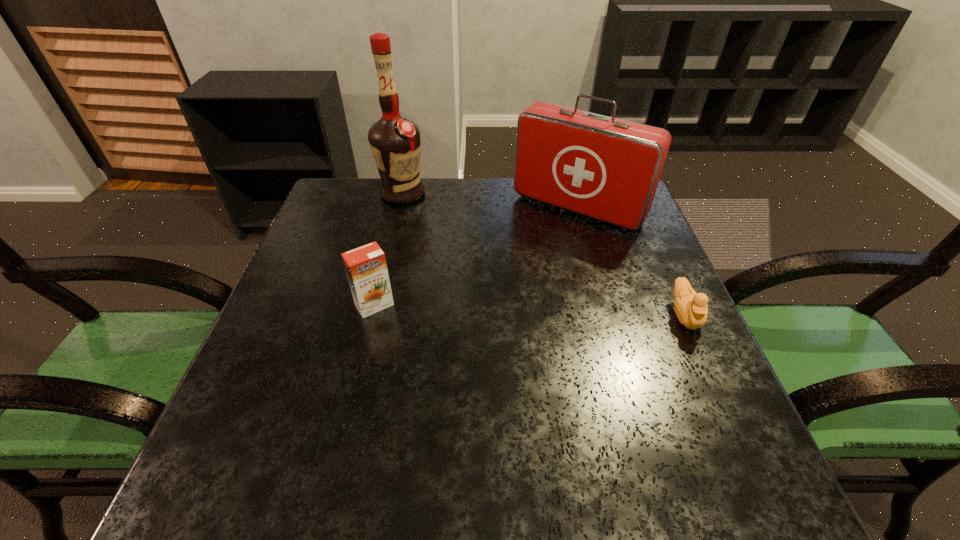
Where is `orange juice`? The image size is (960, 540). orange juice is located at coordinates (366, 268).

In order to click on the shortest object in this screenshot , I will do coord(690,307).

What are the coordinates of `the tallest object` in the screenshot? It's located at (395, 143).

You are a GUI agent. You are given a task and a screenshot of the screen. Output one action in this format:
    pyautogui.click(x=<x>, y=<y>)
    Task: Click on the second tallest object
    This screenshot has width=960, height=540.
    Given the screenshot: What is the action you would take?
    pyautogui.click(x=602, y=167)

Find the location of `vacant space situated 0.080m on the right of the orange juice`. vacant space situated 0.080m on the right of the orange juice is located at coordinates (431, 305).

Image resolution: width=960 pixels, height=540 pixels. I want to click on vacant space situated on the face of the shortest object, so click(705, 361).

Where is `vacant region located 0.310m on the front and back of the liquor`? The width and height of the screenshot is (960, 540). vacant region located 0.310m on the front and back of the liquor is located at coordinates (460, 269).

This screenshot has height=540, width=960. Find the location of `free space located on the front and back of the liquor`. free space located on the front and back of the liquor is located at coordinates (452, 260).

You are a GUI agent. You are given a task and a screenshot of the screen. Output one action in this format:
    pyautogui.click(x=<x>, y=<y>)
    Task: Click on the vacant space located on the front and back of the liquor
    This screenshot has height=540, width=960.
    Given the screenshot: What is the action you would take?
    pyautogui.click(x=468, y=279)

The width and height of the screenshot is (960, 540). I want to click on blank space located on the side of the first-aid kit with the first aid cross symbol, so click(541, 242).